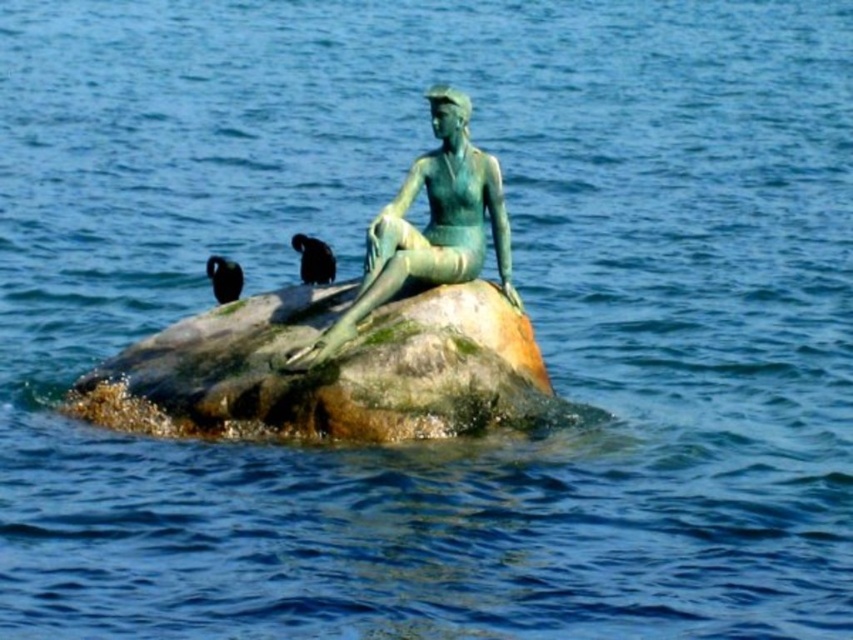
You are a sculptor analyzing the composition of the scene. Based on the placement of the green patina rock at center and the green patina bronze statue at center, which object is positioned lower in the image?

The green patina rock at center is positioned lower in the image as it is situated below the green patina bronze statue at center.